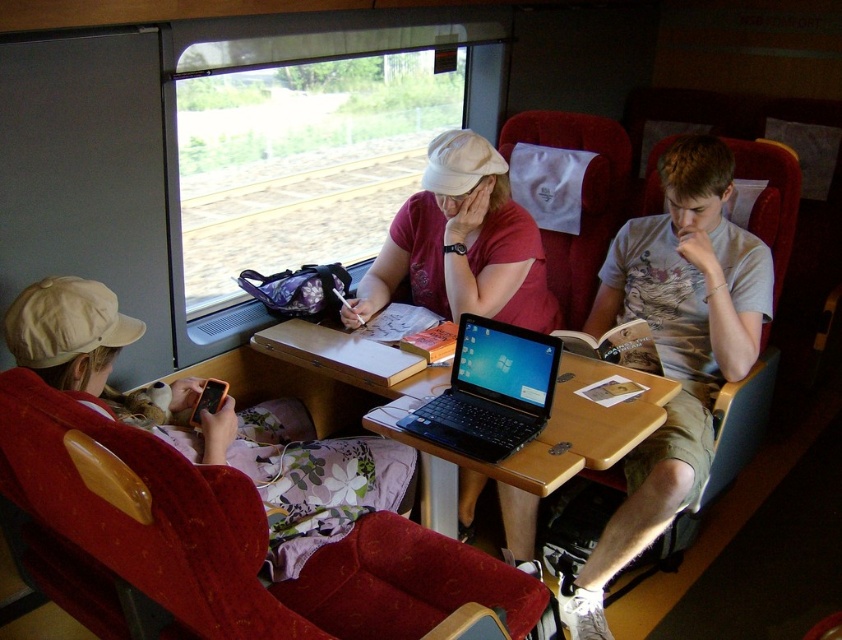
Between matte pink shirt at center and wooden at center, which one has more height?

matte pink shirt at center is taller.

This screenshot has width=842, height=640. In order to click on matte pink shirt at center in this screenshot , I will do `click(461, 244)`.

Is wooden at center to the left of black plastic laptop at center from the viewer's perspective?

Indeed, wooden at center is positioned on the left side of black plastic laptop at center.

Which is in front, point (496, 470) or point (438, 432)?

Point (496, 470)

Based on the photo, who is more distant from viewer, (x=429, y=396) or (x=491, y=444)?

Point (x=429, y=396)

Where is `wooden at center`? The image size is (842, 640). wooden at center is located at coordinates (569, 429).

Does light gray cotton t-shirt at center have a greater height compared to black plastic laptop at center?

Indeed, light gray cotton t-shirt at center has a greater height compared to black plastic laptop at center.

In the scene shown: Can you confirm if light gray cotton t-shirt at center is thinner than black plastic laptop at center?

Incorrect, light gray cotton t-shirt at center's width is not less than black plastic laptop at center's.

Find the location of `light gray cotton t-shirt at center`. light gray cotton t-shirt at center is located at coordinates (675, 349).